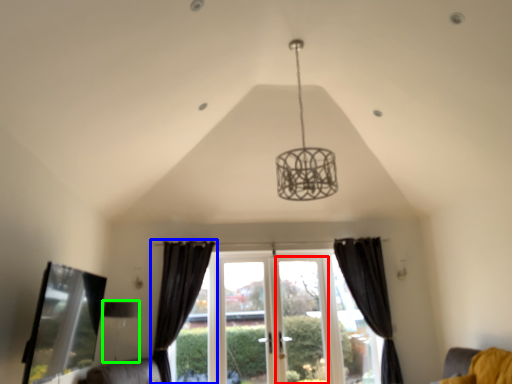
Question: Estimate the real-world distances between objects in this image. Which object is farther from screen door (highlighted by a red box), curtain (highlighted by a blue box) or lamp (highlighted by a green box)?

Choices:
 (A) curtain
 (B) lamp

Answer: (B)